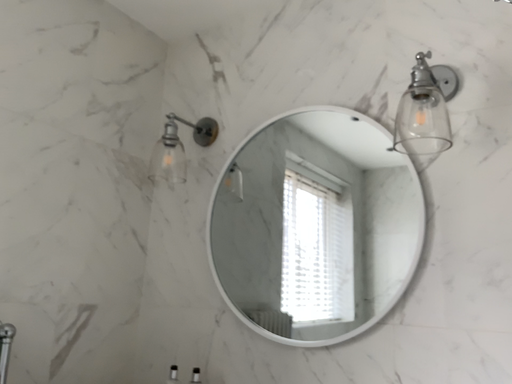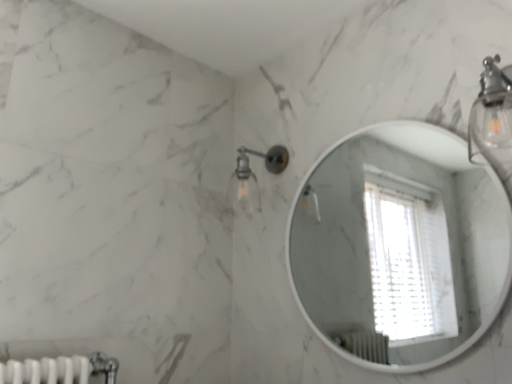
Question: Which way did the camera rotate in the video?

Choices:
 (A) rotated right
 (B) rotated left

Answer: (B)